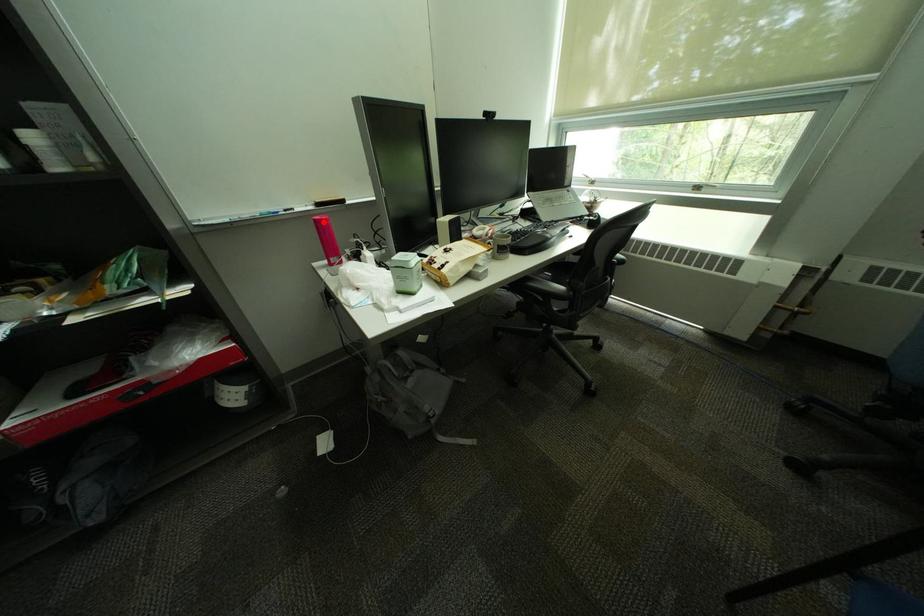
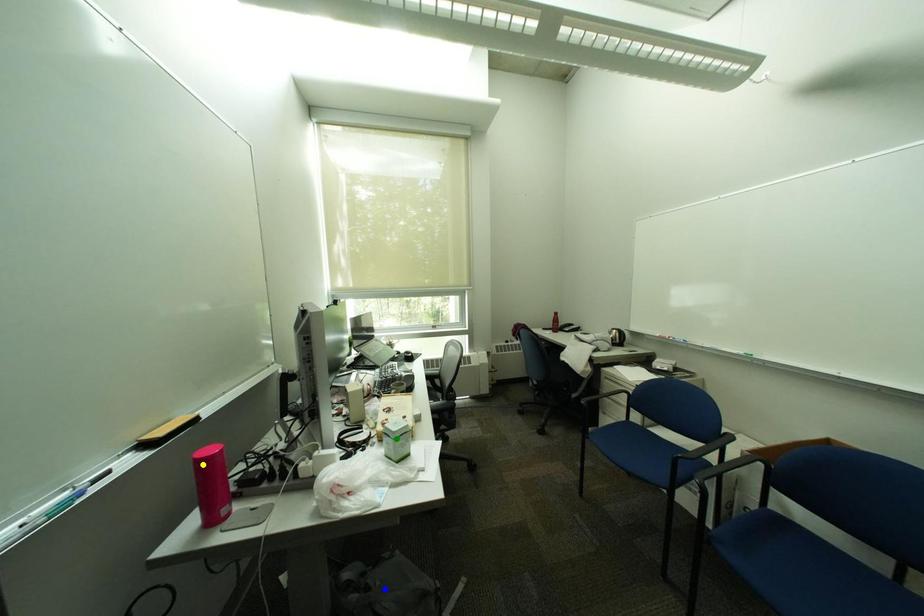
Question: I am providing you with two images of the same scene from different viewpoints. A red point is marked on the first image. You are given multiple points on the second image. Which mark in image 2 goes with the point in image 1?

Choices:
 (A) blue point
 (B) green point
 (C) yellow point

Answer: (C)